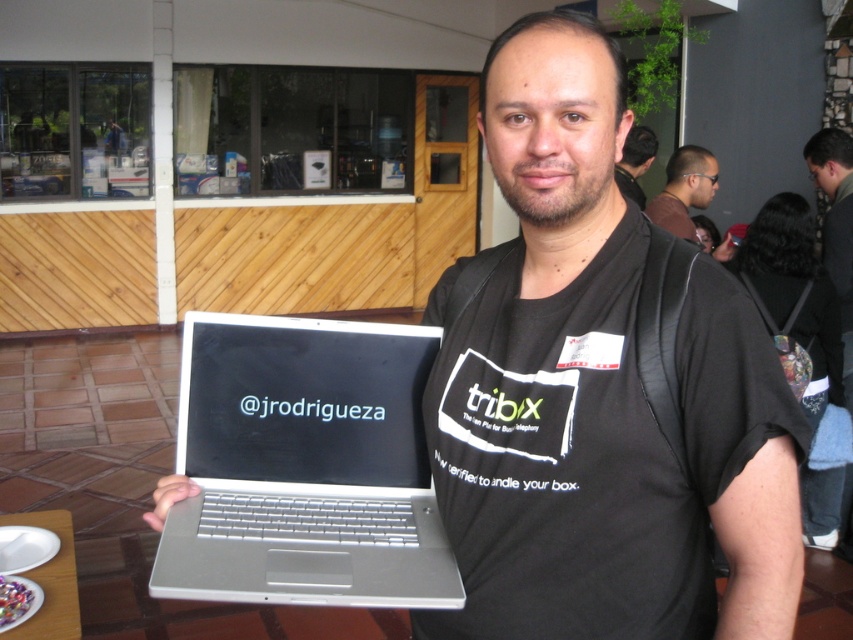
Does silver metallic laptop at center appear on the right side of black fabric backpack at upper right?

In fact, silver metallic laptop at center is to the left of black fabric backpack at upper right.

Is silver metallic laptop at center to the left of black fabric backpack at upper right from the viewer's perspective?

Correct, you'll find silver metallic laptop at center to the left of black fabric backpack at upper right.

Identify the location of silver metallic laptop at center. (305, 467).

Image resolution: width=853 pixels, height=640 pixels. What do you see at coordinates (305, 467) in the screenshot? I see `silver metallic laptop at center` at bounding box center [305, 467].

Is silver metallic laptop at center further to the viewer compared to black matte laptop at center?

That is False.

Where is `silver metallic laptop at center`? silver metallic laptop at center is located at coordinates (305, 467).

Is silver metallic laptop at center taller than matte black laptop at upper center?

Incorrect, silver metallic laptop at center's height is not larger of matte black laptop at upper center's.

Which is behind, point (312, 540) or point (689, 164)?

The point (689, 164) is behind.

Find the location of a particular element. The height and width of the screenshot is (640, 853). silver metallic laptop at center is located at coordinates (305, 467).